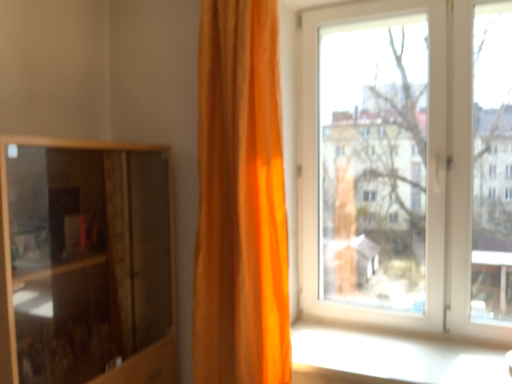
Question: Relative to white plastic window at upper right, is orange fabric curtain at center in front or behind?

Choices:
 (A) front
 (B) behind

Answer: (A)

Question: From the image's perspective, relative to white plastic window at upper right, is orange fabric curtain at center above or below?

Choices:
 (A) above
 (B) below

Answer: (B)

Question: Estimate the real-world distances between objects in this image. Which object is farther from the white glossy window sill at lower right?

Choices:
 (A) wooden cabinet at left
 (B) white plastic window at upper right
 (C) orange fabric curtain at center

Answer: (A)

Question: Estimate the real-world distances between objects in this image. Which object is farther from the orange fabric curtain at center?

Choices:
 (A) wooden cabinet at left
 (B) white glossy window sill at lower right
 (C) white plastic window at upper right

Answer: (C)